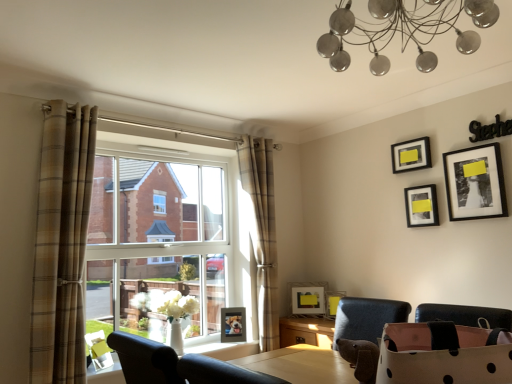
Question: Is velvet black chair at lower center at the left side of plaid fabric curtain at center, which is counted as the first curtain, starting from the back?

Choices:
 (A) yes
 (B) no

Answer: (A)

Question: Is velvet black chair at lower center far away from plaid fabric curtain at center, which is counted as the first curtain, starting from the back?

Choices:
 (A) yes
 (B) no

Answer: (A)

Question: Is velvet black chair at lower center to the right of plaid fabric curtain at center, which is counted as the first curtain, starting from the back, from the viewer's perspective?

Choices:
 (A) yes
 (B) no

Answer: (B)

Question: Does velvet black chair at lower center have a greater width compared to plaid fabric curtain at center, placed as the 2th curtain when sorted from front to back?

Choices:
 (A) yes
 (B) no

Answer: (A)

Question: Does velvet black chair at lower center have a lesser width compared to plaid fabric curtain at center, placed as the 2th curtain when sorted from front to back?

Choices:
 (A) yes
 (B) no

Answer: (B)

Question: Does velvet black chair at lower center come in front of plaid fabric curtain at center, arranged as the second curtain when viewed from the left?

Choices:
 (A) yes
 (B) no

Answer: (A)

Question: Is matte yellow picture frame at lower center, which is the 2th picture frame in left-to-right order, to the left of plaid fabric curtain at center, placed as the 2th curtain when sorted from front to back, from the viewer's perspective?

Choices:
 (A) no
 (B) yes

Answer: (A)

Question: From the image's perspective, would you say matte yellow picture frame at lower center, which ranks as the 4th picture frame in top-to-bottom order, is shown under plaid fabric curtain at center, which is counted as the first curtain, starting from the back?

Choices:
 (A) no
 (B) yes

Answer: (B)

Question: From a real-world perspective, is matte yellow picture frame at lower center, arranged as the third picture frame when ordered from the bottom, positioned over plaid fabric curtain at center, placed as the 2th curtain when sorted from front to back, based on gravity?

Choices:
 (A) no
 (B) yes

Answer: (A)

Question: Can you confirm if matte yellow picture frame at lower center, which ranks as the 4th picture frame in top-to-bottom order, is thinner than plaid fabric curtain at center, placed as the 2th curtain when sorted from front to back?

Choices:
 (A) no
 (B) yes

Answer: (B)

Question: Can you confirm if matte yellow picture frame at lower center, arranged as the third picture frame when ordered from the bottom, is shorter than plaid fabric curtain at center, which is counted as the first curtain, starting from the back?

Choices:
 (A) yes
 (B) no

Answer: (A)

Question: From the image's perspective, is matte yellow picture frame at lower center, which is the 2th picture frame in left-to-right order, located above plaid fabric curtain at center, the first curtain when ordered from right to left?

Choices:
 (A) yes
 (B) no

Answer: (B)

Question: From the image's perspective, is matte black picture frame at center, marked as the third picture frame in a left-to-right arrangement, above matte black picture frame at upper right, the 1th picture frame in the top-to-bottom sequence?

Choices:
 (A) yes
 (B) no

Answer: (B)